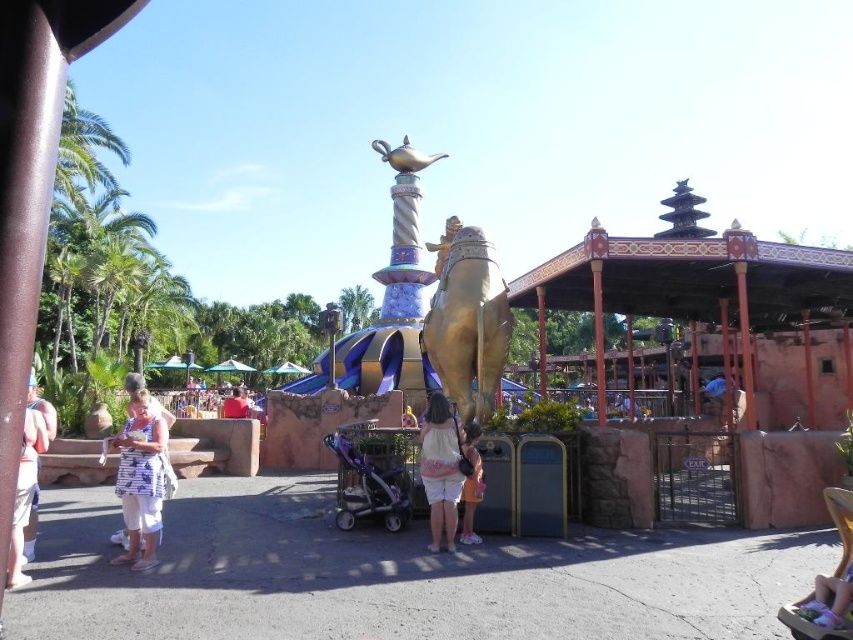
Does white printed dress at lower left appear over white cotton dress at lower left?

No, white printed dress at lower left is not above white cotton dress at lower left.

Is white printed dress at lower left shorter than white cotton dress at lower left?

Yes, white printed dress at lower left is shorter than white cotton dress at lower left.

Between point (132, 506) and point (35, 490), which one is positioned behind?

Point (132, 506)

Locate an element on the screen. The height and width of the screenshot is (640, 853). white printed dress at lower left is located at coordinates (140, 480).

Does white cotton shirt at center appear on the right side of white cotton dress at center?

In fact, white cotton shirt at center is to the left of white cotton dress at center.

Where is `white cotton shirt at center`? This screenshot has height=640, width=853. white cotton shirt at center is located at coordinates (440, 468).

Locate an element on the screen. The image size is (853, 640). white cotton shirt at center is located at coordinates (440, 468).

Does white cotton dress at lower left come behind white cotton dress at center?

No.

Can you confirm if white cotton dress at lower left is positioned to the right of white cotton dress at center?

In fact, white cotton dress at lower left is to the left of white cotton dress at center.

The image size is (853, 640). Describe the element at coordinates (28, 480) in the screenshot. I see `white cotton dress at lower left` at that location.

Locate an element on the screen. The image size is (853, 640). white cotton dress at lower left is located at coordinates (28, 480).